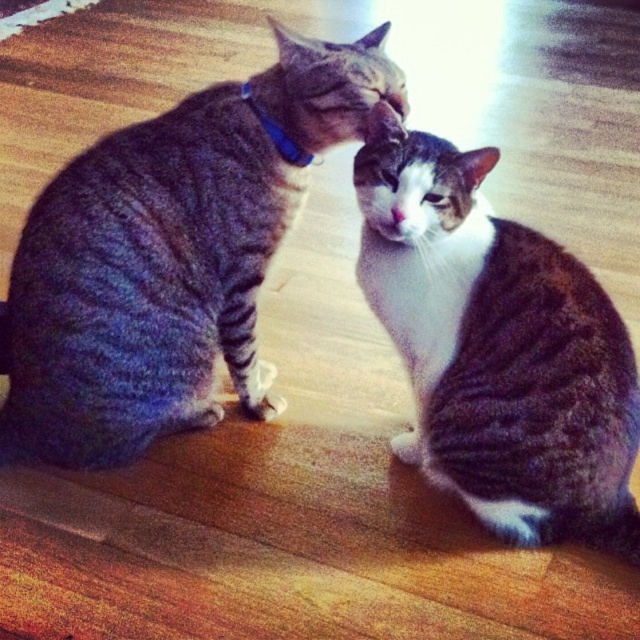
Does blue fabric neckband at upper center have a lesser width compared to white fur at center?

In fact, blue fabric neckband at upper center might be wider than white fur at center.

Is point (296, 148) farther from viewer compared to point (403, 218)?

Yes, it is behind point (403, 218).

Does point (260, 113) come behind point (403, 218)?

Yes, point (260, 113) is behind point (403, 218).

The image size is (640, 640). I want to click on blue fabric neckband at upper center, so click(276, 131).

Is point (400, 324) farther from viewer compared to point (282, 131)?

No, it is not.

Does gray tabby cat at center have a lesser width compared to blue fabric neckband at upper center?

No.

Between point (588, 518) and point (288, 147), which one is positioned in front?

Point (588, 518)

This screenshot has height=640, width=640. In order to click on gray tabby cat at center in this screenshot , I will do `click(497, 348)`.

Which is behind, point (67, 205) or point (492, 304)?

The point (67, 205) is more distant.

Does gray striped cat at left have a smaller size compared to gray tabby cat at center?

Actually, gray striped cat at left might be larger than gray tabby cat at center.

Between point (145, 374) and point (460, 397), which one is positioned in front?

Positioned in front is point (460, 397).

You are a GUI agent. You are given a task and a screenshot of the screen. Output one action in this format:
    pyautogui.click(x=<x>, y=<y>)
    Task: Click on the gray striped cat at left
    
    Given the screenshot: What is the action you would take?
    pyautogui.click(x=144, y=284)